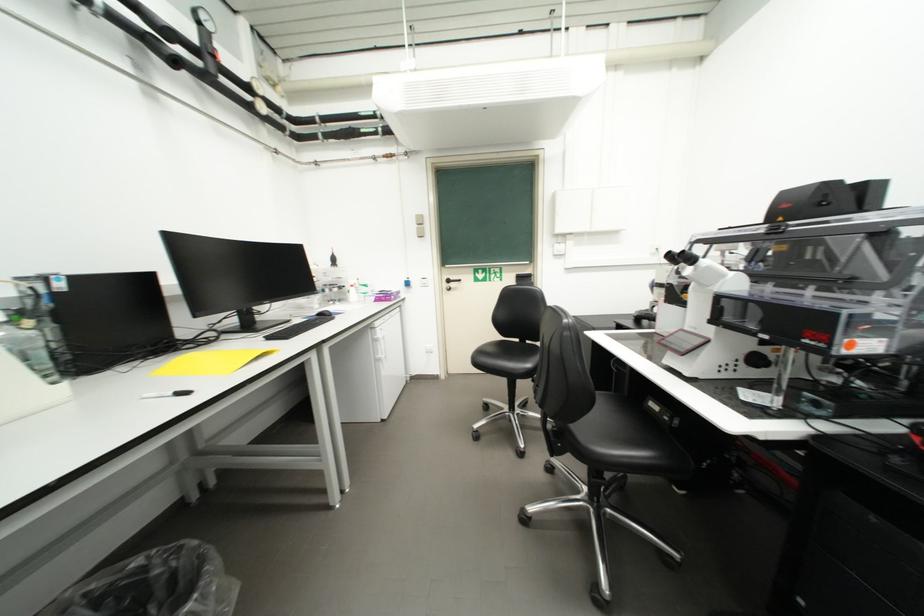
Describe the element at coordinates (558, 248) in the screenshot. I see `the white light switch` at that location.